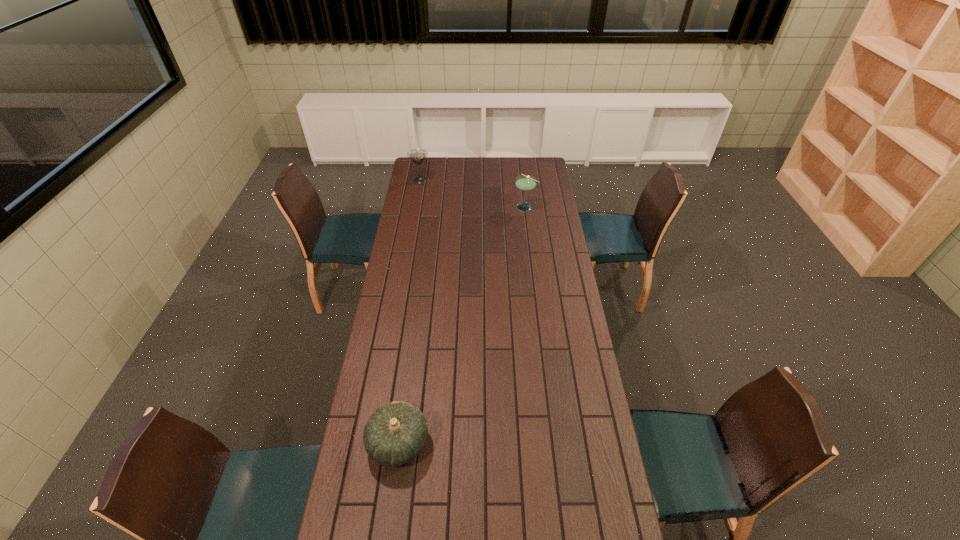
Find the location of a particular element. vacant area that lies between the left martini and the nearest object is located at coordinates (409, 311).

Image resolution: width=960 pixels, height=540 pixels. What are the coordinates of `empty space between the nearest object and the rightmost object` in the screenshot? It's located at (462, 325).

I want to click on unoccupied area between the nearest object and the rightmost object, so pos(462,325).

Locate which object is the closest to the nearer martini. Please provide its 2D coordinates. Your answer should be formatted as a tuple, i.e. [(x, y)], where the tuple contains the x and y coordinates of a point satisfying the conditions above.

[(418, 155)]

What are the coordinates of `object that stands as the second closest to the left martini` in the screenshot? It's located at (395, 434).